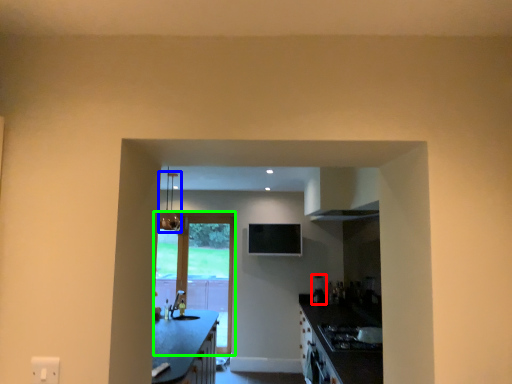
Question: Which object is positioned closest to appliance (highlighted by a red box)? Select from light fixture (highlighted by a blue box) and door (highlighted by a green box).

Choices:
 (A) light fixture
 (B) door

Answer: (B)